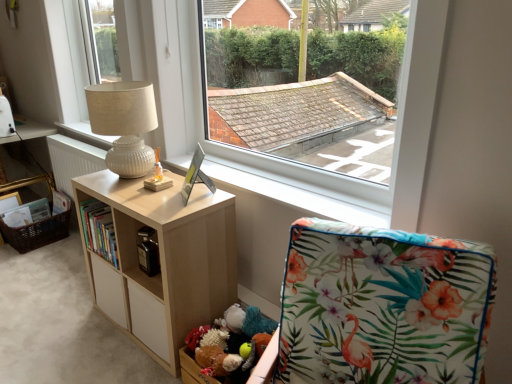
What do you see at coordinates (340, 174) in the screenshot? I see `transparent glass window at upper center, the first window in the right-to-left sequence` at bounding box center [340, 174].

Describe the element at coordinates (99, 230) in the screenshot. This screenshot has width=512, height=384. I see `hardcover book at center` at that location.

Image resolution: width=512 pixels, height=384 pixels. In order to click on beige fabric lampshade at upper left, marked as the 2th window in a front-to-back arrangement in this screenshot , I will do click(x=91, y=46).

The width and height of the screenshot is (512, 384). What do you see at coordinates (124, 124) in the screenshot?
I see `white textured lamp at upper left` at bounding box center [124, 124].

This screenshot has width=512, height=384. In order to click on light wood/texture bookshelf at center in this screenshot , I will do `click(161, 260)`.

The image size is (512, 384). In order to click on the 2nd window above when counting from the hardcover book at center (from the image's perspective) in this screenshot , I will do (x=91, y=46).

From the image's perspective, who appears lower, beige fabric lampshade at upper left, the 1th window from the back, or hardcover book at center?

hardcover book at center, from the image's perspective.

Which is nearer, (83, 39) or (93, 244)?

Point (83, 39) appears to be farther away from the viewer than point (93, 244).

Considering the relative positions of hardcover book at center and white glossy radiator at left in the image provided, is hardcover book at center to the right of white glossy radiator at left from the viewer's perspective?

Indeed, hardcover book at center is positioned on the right side of white glossy radiator at left.

Locate an element on the screen. The height and width of the screenshot is (384, 512). book in front of the white glossy radiator at left is located at coordinates (99, 230).

From a real-world perspective, is hardcover book at center physically above white glossy radiator at left?

Yes, from a real-world perspective, hardcover book at center is over white glossy radiator at left

Is white glossy radiator at left shorter than white wooden window sill at center?

Incorrect, the height of white glossy radiator at left does not fall short of that of white wooden window sill at center.

From a real-world perspective, is white glossy radiator at left positioned above or below white wooden window sill at center?

white glossy radiator at left is below white wooden window sill at center.

Does point (61, 149) appear closer or farther from the camera than point (230, 163)?

Point (61, 149) is farther from the camera than point (230, 163).

This screenshot has height=384, width=512. Identify the location of radiator on the left of white wooden window sill at center. (73, 160).

How much distance is there between white glossy radiator at left and light wood/texture bookshelf at center?

white glossy radiator at left is 3.45 feet away from light wood/texture bookshelf at center.

Between white glossy radiator at left and light wood/texture bookshelf at center, which one has less height?

Standing shorter between the two is white glossy radiator at left.

From a real-world perspective, who is located lower, white glossy radiator at left or light wood/texture bookshelf at center?

light wood/texture bookshelf at center, from a real-world perspective.

Does white glossy radiator at left come behind light wood/texture bookshelf at center?

Yes, it is behind light wood/texture bookshelf at center.

Is point (104, 212) behind point (55, 241)?

No, it is in front of (55, 241).

From a real-world perspective, is hardcover book at center above or below brown woven basket at lower left?

hardcover book at center is above brown woven basket at lower left.

Is hardcover book at center closer to the viewer compared to brown woven basket at lower left?

Yes, hardcover book at center is closer to the viewer.

In order to click on rocking chair below the white wooden window sill at center (from the image's perspective) in this screenshot , I will do `click(383, 306)`.

Which of these two, floral fabric rocking chair at lower right or white wooden window sill at center, stands shorter?

With less height is white wooden window sill at center.

From a real-world perspective, does floral fabric rocking chair at lower right sit lower than white wooden window sill at center?

Yes.

Consider the image. How distant is floral fabric rocking chair at lower right from white wooden window sill at center?

floral fabric rocking chair at lower right and white wooden window sill at center are 48.57 centimeters apart from each other.

Can you confirm if hardcover book at center is shorter than light wood/texture bookshelf at center?

Indeed, hardcover book at center has a lesser height compared to light wood/texture bookshelf at center.

Is hardcover book at center far from light wood/texture bookshelf at center?

hardcover book at center is actually quite close to light wood/texture bookshelf at center.

Could you tell me if hardcover book at center is facing light wood/texture bookshelf at center?

Yes.

Between hardcover book at center and light wood/texture bookshelf at center, which one appears on the right side from the viewer's perspective?

From the viewer's perspective, light wood/texture bookshelf at center appears more on the right side.

This screenshot has width=512, height=384. What are the coordinates of `book that appears below the beige fabric lampshade at upper left, the 1th window from the back (from the image's perspective)` in the screenshot? It's located at (99, 230).

The height and width of the screenshot is (384, 512). Find the location of `radiator above the hardcover book at center (from the image's perspective)`. radiator above the hardcover book at center (from the image's perspective) is located at coordinates (73, 160).

Based on their spatial positions, is transparent glass window at upper center, the 2th window from the left, or hardcover book at center further from light wood/texture bookshelf at center?

transparent glass window at upper center, the 2th window from the left, is further to light wood/texture bookshelf at center.

Looking at this image, looking at the image, which one is located further to hardcover book at center, floral fabric rocking chair at lower right or white wooden window sill at center?

Based on the image, floral fabric rocking chair at lower right appears to be further to hardcover book at center.

Looking at the image, which one is located further to brown woven basket at lower left, transparent glass window at upper center, the first window in the right-to-left sequence, or light wood/texture bookshelf at center?

The object further to brown woven basket at lower left is transparent glass window at upper center, the first window in the right-to-left sequence.

Based on their spatial positions, is white glossy radiator at left or floral fabric rocking chair at lower right further from light wood/texture bookshelf at center?

white glossy radiator at left is further to light wood/texture bookshelf at center.

Looking at the image, which one is located closer to beige fabric lampshade at upper left, marked as the 2th window in a front-to-back arrangement, white glossy radiator at left or hardcover book at center?

white glossy radiator at left is positioned closer to the anchor beige fabric lampshade at upper left, marked as the 2th window in a front-to-back arrangement.

When comparing their distances from brown woven basket at lower left, does transparent glass window at upper center, acting as the first window starting from the front, or white wooden window sill at center seem further?

Among the two, transparent glass window at upper center, acting as the first window starting from the front, is located further to brown woven basket at lower left.

From the image, which object appears to be nearer to light wood/texture bookshelf at center, white wooden window sill at center or transparent glass window at upper center, which is the second window from back to front?

Among the two, white wooden window sill at center is located nearer to light wood/texture bookshelf at center.

Estimate the real-world distances between objects in this image. Which object is further from brown woven basket at lower left, white glossy radiator at left or transparent glass window at upper center, acting as the first window starting from the front?

Among the two, transparent glass window at upper center, acting as the first window starting from the front, is located further to brown woven basket at lower left.

At what (x,y) coordinates should I click in order to perform the action: click on book located between transparent glass window at upper center, the 2th window from the left, and brown woven basket at lower left in the depth direction. Please return your answer as a coordinate pair (x, y). Looking at the image, I should click on (99, 230).

The image size is (512, 384). I want to click on window situated between white glossy radiator at left and white wooden window sill at center from left to right, so click(91, 46).

Image resolution: width=512 pixels, height=384 pixels. What are the coordinates of `radiator between beige fabric lampshade at upper left, the second window from the right, and brown woven basket at lower left in the up-down direction` in the screenshot? It's located at (73, 160).

At what (x,y) coordinates should I click in order to perform the action: click on book between floral fabric rocking chair at lower right and beige fabric lampshade at upper left, marked as the 2th window in a front-to-back arrangement, from front to back. Please return your answer as a coordinate pair (x, y). Image resolution: width=512 pixels, height=384 pixels. Looking at the image, I should click on (99, 230).